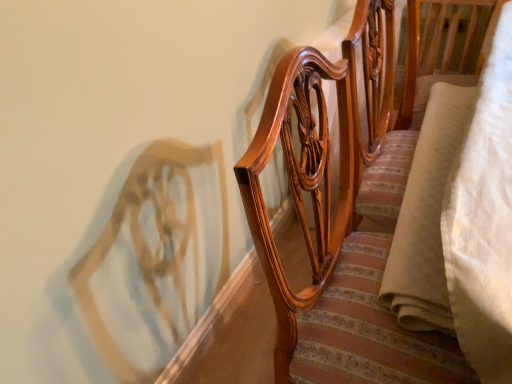
Question: Does glossy wood chair at upper center turn towards beige suede blanket at right?

Choices:
 (A) yes
 (B) no

Answer: (A)

Question: From a real-world perspective, is glossy wood chair at upper center located higher than beige suede blanket at right?

Choices:
 (A) no
 (B) yes

Answer: (A)

Question: Is glossy wood chair at upper center positioned with its back to beige suede blanket at right?

Choices:
 (A) no
 (B) yes

Answer: (A)

Question: Is glossy wood chair at upper center thinner than beige suede blanket at right?

Choices:
 (A) no
 (B) yes

Answer: (A)

Question: Does glossy wood chair at upper center lie in front of beige suede blanket at right?

Choices:
 (A) no
 (B) yes

Answer: (B)

Question: From the image's perspective, is glossy wood chair at upper center located beneath beige suede blanket at right?

Choices:
 (A) yes
 (B) no

Answer: (A)

Question: Is beige suede blanket at right positioned far away from glossy wood chair at upper center?

Choices:
 (A) no
 (B) yes

Answer: (A)

Question: Is beige suede blanket at right next to glossy wood chair at upper center and touching it?

Choices:
 (A) yes
 (B) no

Answer: (B)

Question: Is beige suede blanket at right thinner than glossy wood chair at upper center?

Choices:
 (A) no
 (B) yes

Answer: (B)

Question: Can you confirm if beige suede blanket at right is taller than glossy wood chair at upper center?

Choices:
 (A) yes
 (B) no

Answer: (B)

Question: Would you say beige suede blanket at right contains glossy wood chair at upper center?

Choices:
 (A) no
 (B) yes

Answer: (A)

Question: Is beige suede blanket at right not within glossy wood chair at upper center?

Choices:
 (A) no
 (B) yes

Answer: (A)

Question: From a real-world perspective, is glossy wood chair at upper center physically located above or below beige suede blanket at right?

Choices:
 (A) below
 (B) above

Answer: (A)